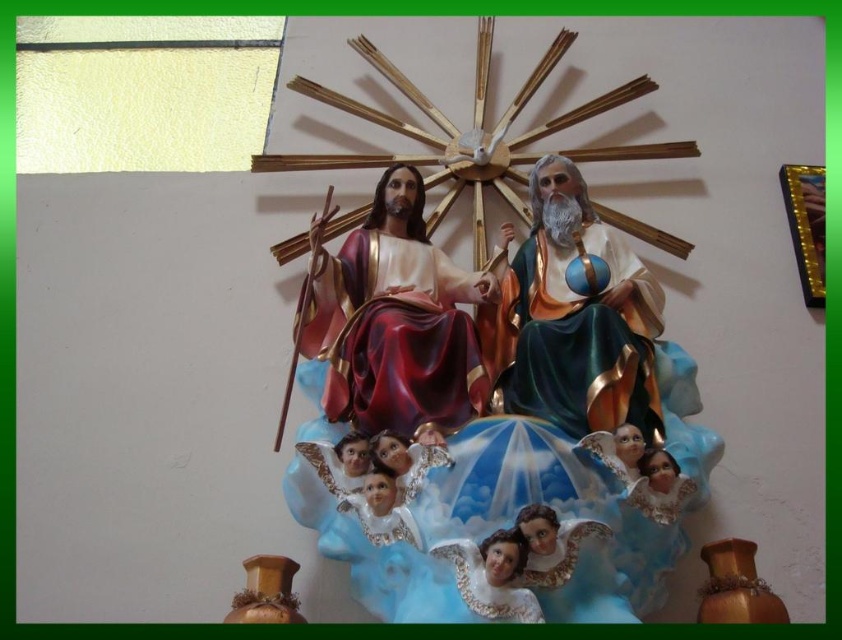
Can you confirm if matte gold statue at center is positioned to the right of smooth porcelain angel at center?

Yes, matte gold statue at center is to the right of smooth porcelain angel at center.

Who is positioned more to the left, matte gold statue at center or smooth porcelain angel at center?

smooth porcelain angel at center

Does point (531, 365) come closer to viewer compared to point (425, 424)?

No, (531, 365) is further to viewer.

What are the coordinates of `matte gold statue at center` in the screenshot? It's located at (574, 320).

Who is taller, matte plastic sculpture at center or smooth porcelain angel at center?

matte plastic sculpture at center

Is matte plastic sculpture at center thinner than smooth porcelain angel at center?

No, matte plastic sculpture at center is not thinner than smooth porcelain angel at center.

In the scene shown: Who is more forward, (x=465, y=356) or (x=427, y=452)?

Point (x=427, y=452)

Identify the location of matte plastic sculpture at center. (488, 381).

Does matte plastic sculpture at center have a larger size compared to matte gold statue at center?

Yes, matte plastic sculpture at center is bigger than matte gold statue at center.

Does matte plastic sculpture at center appear on the left side of matte gold statue at center?

Indeed, matte plastic sculpture at center is positioned on the left side of matte gold statue at center.

Locate an element on the screen. The width and height of the screenshot is (842, 640). matte plastic sculpture at center is located at coordinates (488, 381).